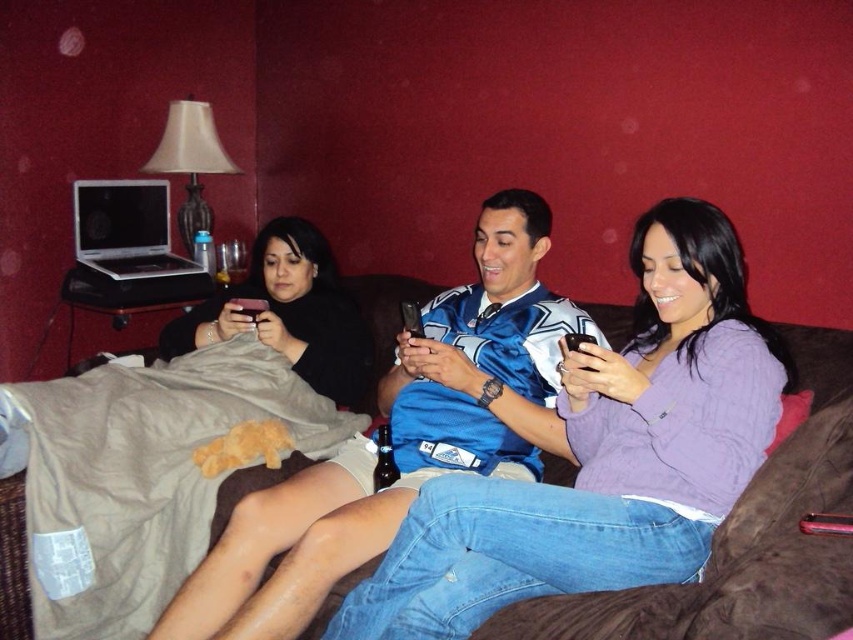
Does purple sweater at center appear on the right side of black glass beer bottle at center?

Indeed, purple sweater at center is positioned on the right side of black glass beer bottle at center.

Locate an element on the screen. This screenshot has width=853, height=640. purple sweater at center is located at coordinates (604, 454).

Does purple sweater at center appear over black matte phone at upper left?

Incorrect, purple sweater at center is not positioned above black matte phone at upper left.

Is point (721, 493) positioned before point (349, 328)?

Yes, it is.

The image size is (853, 640). Find the location of `purple sweater at center`. purple sweater at center is located at coordinates (604, 454).

Does black matte phone at upper left lie behind black glass beer bottle at center?

That is False.

Is point (21, 452) farther from camera compared to point (392, 458)?

Yes.

Where is `black matte phone at upper left`? black matte phone at upper left is located at coordinates (178, 435).